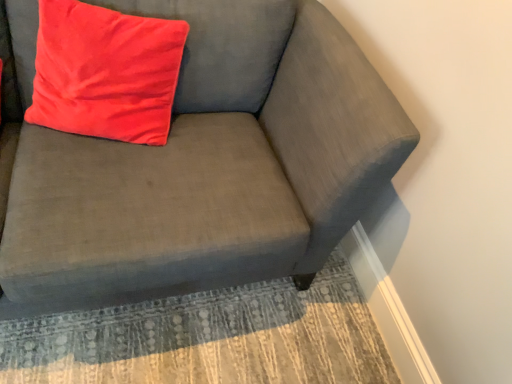
Question: From the image's perspective, is textured beige rug at lower center located beneath matte gray couch at upper right?

Choices:
 (A) no
 (B) yes

Answer: (B)

Question: Can you confirm if textured beige rug at lower center is wider than matte gray couch at upper right?

Choices:
 (A) yes
 (B) no

Answer: (A)

Question: Does textured beige rug at lower center have a greater height compared to matte gray couch at upper right?

Choices:
 (A) no
 (B) yes

Answer: (A)

Question: Is textured beige rug at lower center facing towards matte gray couch at upper right?

Choices:
 (A) yes
 (B) no

Answer: (B)

Question: Can you confirm if textured beige rug at lower center is positioned to the left of matte gray couch at upper right?

Choices:
 (A) yes
 (B) no

Answer: (B)

Question: Is matte gray couch at upper right completely or partially inside textured beige rug at lower center?

Choices:
 (A) yes
 (B) no

Answer: (B)

Question: Is textured beige rug at lower center at the back of matte gray couch at upper right?

Choices:
 (A) yes
 (B) no

Answer: (B)

Question: Can you confirm if matte gray couch at upper right is positioned to the left of textured beige rug at lower center?

Choices:
 (A) no
 (B) yes

Answer: (B)

Question: Does matte gray couch at upper right have a greater width compared to textured beige rug at lower center?

Choices:
 (A) yes
 (B) no

Answer: (B)

Question: Is matte gray couch at upper right next to textured beige rug at lower center and touching it?

Choices:
 (A) no
 (B) yes

Answer: (A)

Question: From the image's perspective, is matte gray couch at upper right on textured beige rug at lower center?

Choices:
 (A) yes
 (B) no

Answer: (A)

Question: Considering the relative sizes of matte gray couch at upper right and textured beige rug at lower center in the image provided, is matte gray couch at upper right thinner than textured beige rug at lower center?

Choices:
 (A) yes
 (B) no

Answer: (A)

Question: Is matte gray couch at upper right located outside matte red pillow at upper left?

Choices:
 (A) yes
 (B) no

Answer: (A)